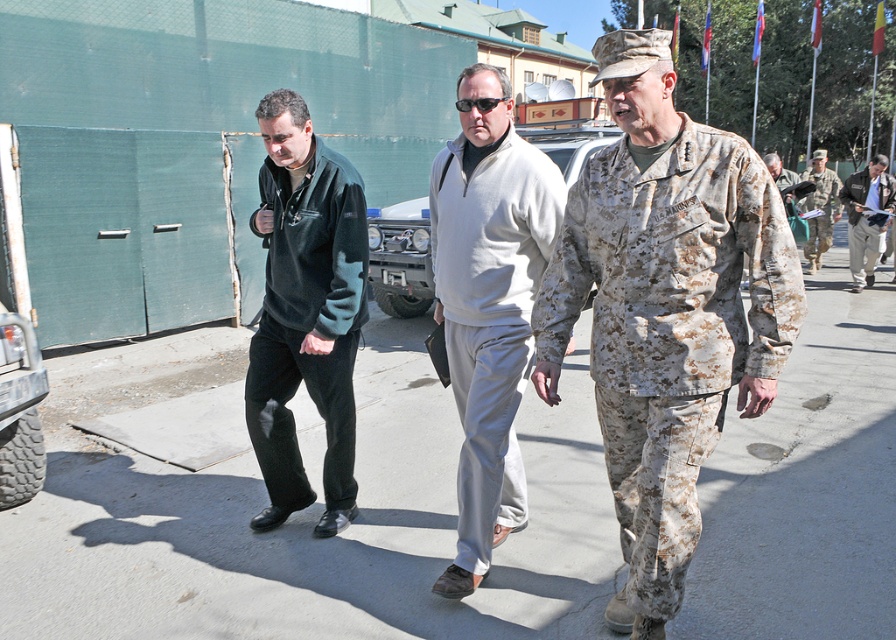
Question: Which object is the closest to the dark green fleece jacket at center?

Choices:
 (A) metallic silver jeep at center
 (B) light gray sweatshirt at center

Answer: (B)

Question: Among these objects, which one is nearest to the camera?

Choices:
 (A) camouflage fabric uniform at center
 (B) camouflage uniform at right
 (C) gray concrete pavement at center

Answer: (A)

Question: Which object is farther from the camera taking this photo?

Choices:
 (A) gray concrete pavement at center
 (B) light gray sweatshirt at center
 (C) light gray fabric jacket at center

Answer: (C)

Question: Is gray concrete pavement at center closer to the viewer compared to light gray fabric jacket at center?

Choices:
 (A) yes
 (B) no

Answer: (A)

Question: Is camouflage fabric uniform at center further to camera compared to metallic silver jeep at center?

Choices:
 (A) no
 (B) yes

Answer: (A)

Question: Is metallic silver jeep at center wider than camouflage uniform at right?

Choices:
 (A) no
 (B) yes

Answer: (A)